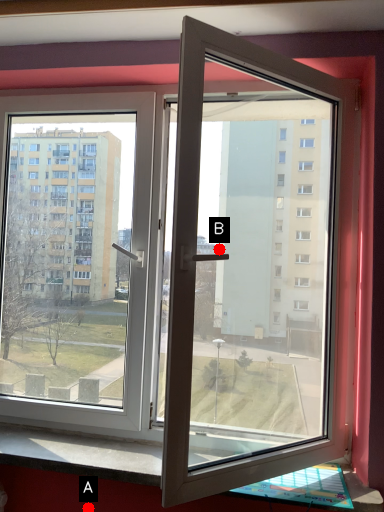
Question: Two points are circled on the image, labeled by A and B beside each circle. Which point appears closest to the camera in this image?

Choices:
 (A) A is closer
 (B) B is closer

Answer: (A)